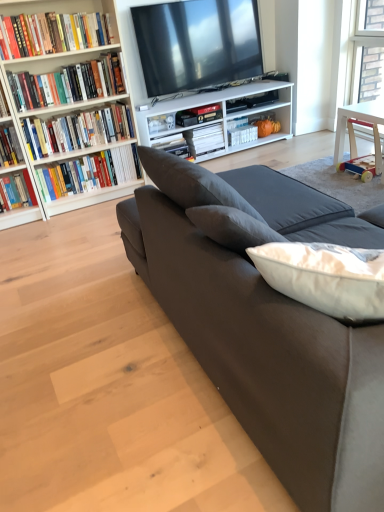
Question: Is white matte book at center, which is the seventh book from front to back, next to suede couch at center and touching it?

Choices:
 (A) yes
 (B) no

Answer: (B)

Question: Can you confirm if white matte book at center, which is the seventh book from front to back, is smaller than suede couch at center?

Choices:
 (A) yes
 (B) no

Answer: (A)

Question: Does white matte book at center, positioned as the 1th book in back-to-front order, lie behind suede couch at center?

Choices:
 (A) yes
 (B) no

Answer: (A)

Question: Is suede couch at center completely or partially inside white matte book at center, which is the seventh book from front to back?

Choices:
 (A) no
 (B) yes

Answer: (A)

Question: Is white matte book at center, which is the seventh book from front to back, to the right of suede couch at center from the viewer's perspective?

Choices:
 (A) yes
 (B) no

Answer: (B)

Question: Looking at their shapes, would you say hardcover book at upper left, which is the 2th book from front to back, is wider or thinner than hardcover book at left, which appears as the fifth book when viewed from the back?

Choices:
 (A) wide
 (B) thin

Answer: (A)

Question: From the image's perspective, is hardcover book at upper left, placed as the 6th book when sorted from back to front, positioned above or below hardcover book at left, the 3th book viewed from the front?

Choices:
 (A) below
 (B) above

Answer: (B)

Question: Looking at the image, does hardcover book at upper left, placed as the 6th book when sorted from back to front, seem bigger or smaller compared to hardcover book at left, which appears as the fifth book when viewed from the back?

Choices:
 (A) big
 (B) small

Answer: (A)

Question: Considering their positions, is hardcover book at upper left, which is the 2th book from front to back, located in front of or behind hardcover book at left, the 3th book viewed from the front?

Choices:
 (A) front
 (B) behind

Answer: (A)

Question: Considering the positions of suede couch at center and white wood bookshelf at left in the image, is suede couch at center wider or thinner than white wood bookshelf at left?

Choices:
 (A) thin
 (B) wide

Answer: (B)

Question: Based on their positions, is suede couch at center located to the left or right of white wood bookshelf at left?

Choices:
 (A) left
 (B) right

Answer: (B)

Question: Considering their positions, is suede couch at center located in front of or behind white wood bookshelf at left?

Choices:
 (A) front
 (B) behind

Answer: (A)

Question: Would you say suede couch at center is inside or outside white wood bookshelf at left?

Choices:
 (A) outside
 (B) inside

Answer: (A)

Question: Would you say white matte book at center, the 6th book viewed from the front, is inside or outside hardcover book at left, which is the 4th book in front-to-back order?

Choices:
 (A) inside
 (B) outside

Answer: (B)

Question: Looking at their shapes, would you say white matte book at center, which ranks as the 2th book in back-to-front order, is wider or thinner than hardcover book at left, which is the 4th book in front-to-back order?

Choices:
 (A) thin
 (B) wide

Answer: (A)